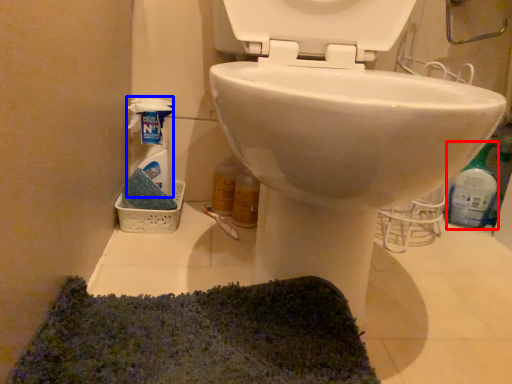
Question: Among these objects, which one is nearest to the camera, cleaning product (highlighted by a red box) or cleaning product (highlighted by a blue box)?

Choices:
 (A) cleaning product
 (B) cleaning product

Answer: (B)